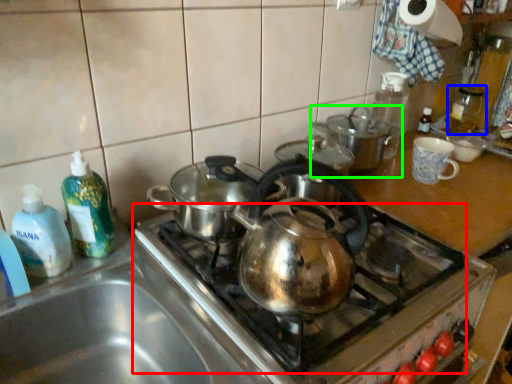
Question: Which is farther away from gas stove (highlighted by a red box)? bottle (highlighted by a blue box) or kitchen appliance (highlighted by a green box)?

Choices:
 (A) bottle
 (B) kitchen appliance

Answer: (A)